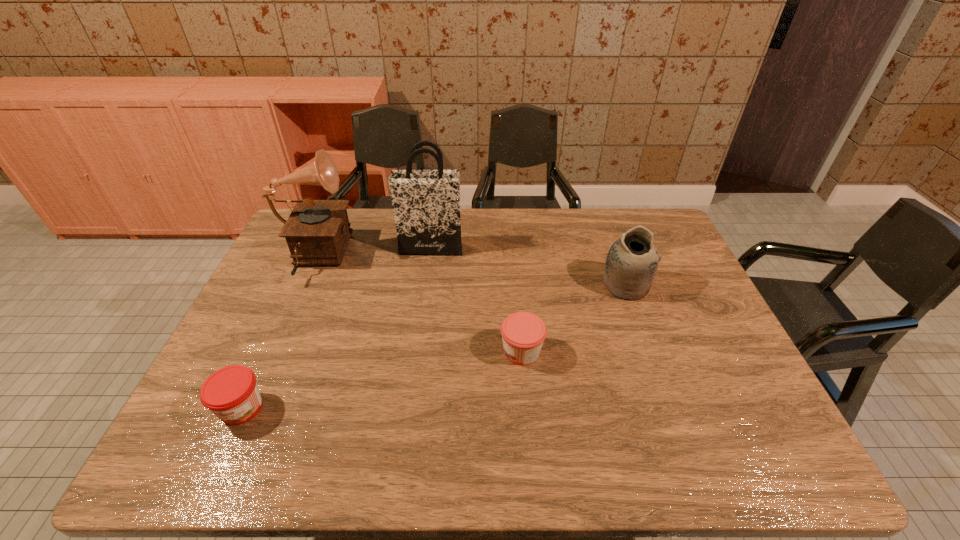
Locate an element on the screen. This screenshot has height=540, width=960. shopping bag is located at coordinates (426, 203).

At what (x,y) coordinates should I click in order to perform the action: click on record player. Please return your answer as a coordinate pair (x, y). Looking at the image, I should click on (317, 232).

I want to click on the rightmost object, so click(632, 261).

This screenshot has width=960, height=540. What are the coordinates of `the third tallest object` in the screenshot? It's located at (632, 261).

Find the location of a particular element. the fourth object from left to right is located at coordinates (523, 333).

At what (x,y) coordinates should I click in order to perform the action: click on the right jam. Please return your answer as a coordinate pair (x, y). Looking at the image, I should click on (523, 333).

At what (x,y) coordinates should I click in order to perform the action: click on the nearer jam. Please return your answer as a coordinate pair (x, y). Looking at the image, I should click on (231, 393).

Identify the location of the left jam. The width and height of the screenshot is (960, 540). (231, 393).

I want to click on vacant space located on the front of the third object from right to left with the design, so click(417, 353).

Image resolution: width=960 pixels, height=540 pixels. I want to click on vacant position located 0.340m on the horn of the record player, so pos(453,258).